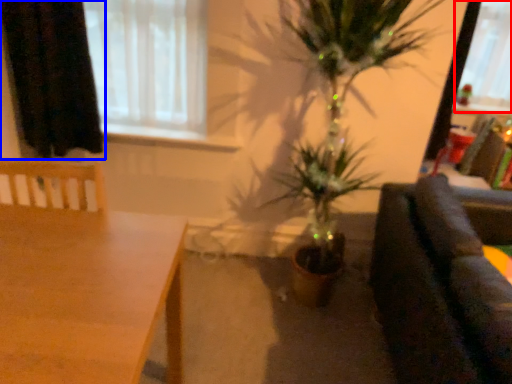
Question: Which point is further to the camera, window screen (highlighted by a red box) or curtain (highlighted by a blue box)?

Choices:
 (A) window screen
 (B) curtain

Answer: (A)